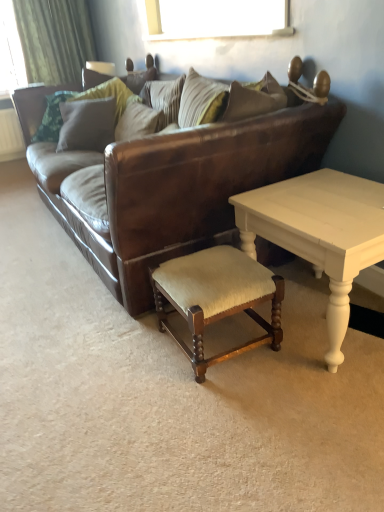
Where is `vacant point above wooden upholstered stool at lower center (from a real-world perspective)`? vacant point above wooden upholstered stool at lower center (from a real-world perspective) is located at coordinates (211, 267).